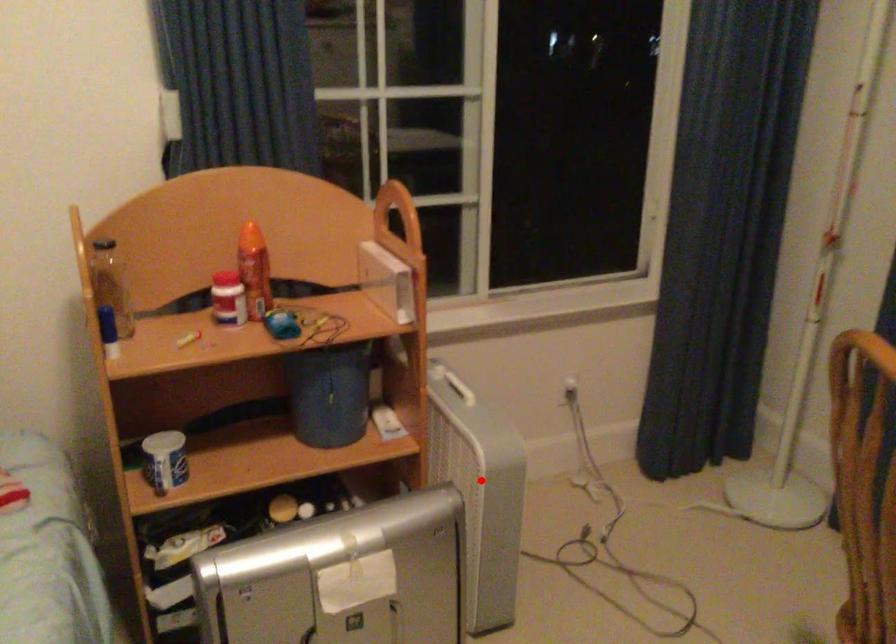
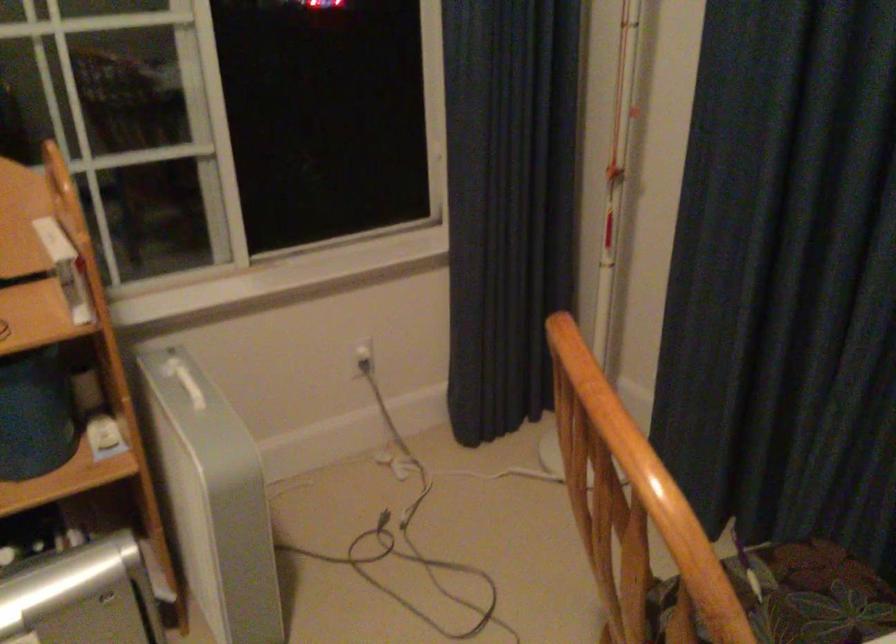
Question: A red point is marked in image1. In image2, is the corresponding 3D point closer to the camera or farther? Reply with the corresponding letter.

Choices:
 (A) The corresponding 3D point is closer.
 (B) The corresponding 3D point is farther.

Answer: (A)